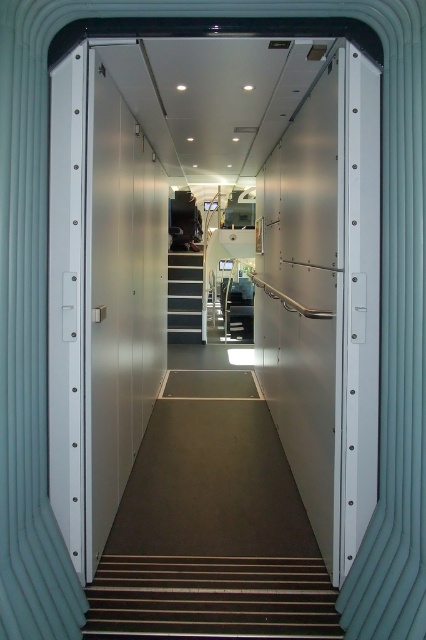
Question: Where is wooden stairs at lower center located in relation to white glossy stair at center in the image?

Choices:
 (A) left
 (B) right

Answer: (B)

Question: Can you confirm if wooden stairs at lower center is positioned to the left of white glossy stair at center?

Choices:
 (A) no
 (B) yes

Answer: (A)

Question: Does wooden stairs at lower center appear under white glossy stair at center?

Choices:
 (A) no
 (B) yes

Answer: (B)

Question: Which of the following is the closest to the observer?

Choices:
 (A) (150, 557)
 (B) (169, 310)

Answer: (A)